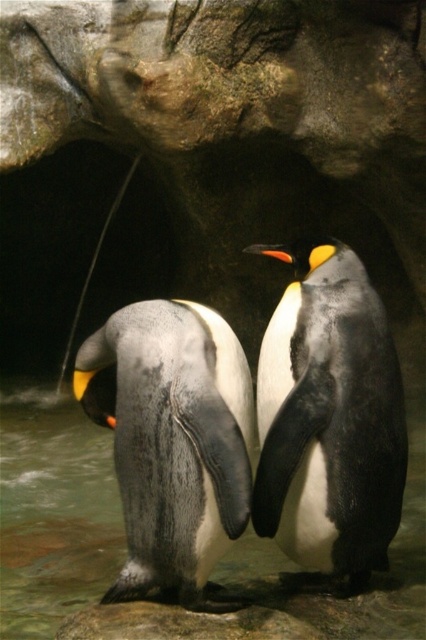
You are a zookeeper who needs to ensure that the white matte penguin at center has enough space to move freely. Given that the translucent wet rock at center is part of its enclosure, can you determine if the penguin has sufficient space based on their sizes?

The white matte penguin at center is narrower than the translucent wet rock at center, so it has enough space to move around the rock in its enclosure.

You are a zookeeper observing two objects in the penguin exhibit. You see the gray matte penguin at center and the translucent wet rock at center. Which object is positioned to the right of the other?

The gray matte penguin at center is to the right of the translucent wet rock at center.

You are a zookeeper standing in front of the penguin exhibit. You need to feed the white matte penguin at center. If your arm can reach 6 feet, can you reach the penguin?

The white matte penguin at center is 6.89 feet away from the viewer. Since your arm can only reach 6 feet, you cannot reach the penguin.